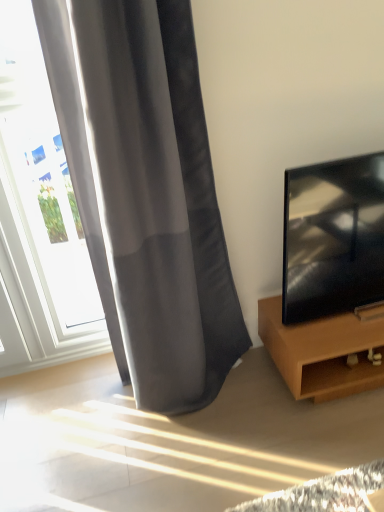
At what (x,y) coordinates should I click in order to perform the action: click on vacant region in front of satin gray curtain at left. Please return your answer as a coordinate pair (x, y). This screenshot has width=384, height=512. Looking at the image, I should click on (203, 458).